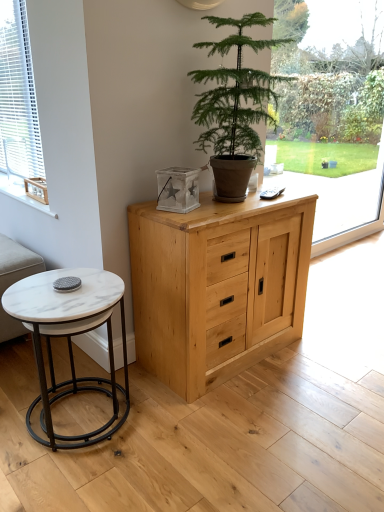
In order to click on empty space that is ontop of white marble coffee table at lower left in this screenshot , I will do `click(67, 291)`.